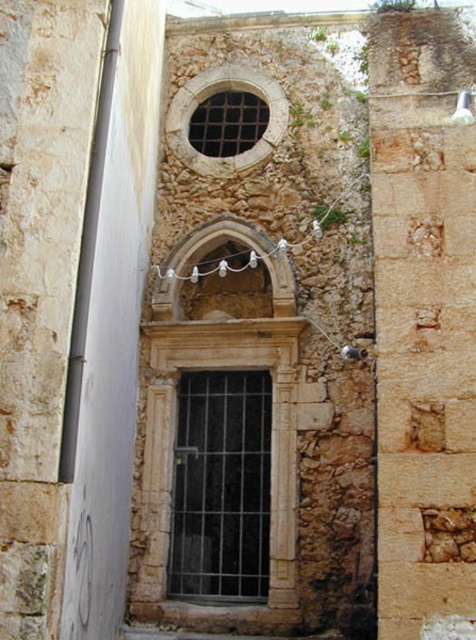
Is stone textured window at upper center below white stone archway at center?

No, stone textured window at upper center is not below white stone archway at center.

Between stone textured window at upper center and white stone archway at center, which one is positioned lower?

Positioned lower is white stone archway at center.

Locate an element on the screen. The width and height of the screenshot is (476, 640). stone textured window at upper center is located at coordinates (219, 92).

At what (x,y) coordinates should I click in order to perform the action: click on stone textured window at upper center. Please return your answer as a coordinate pair (x, y). The height and width of the screenshot is (640, 476). Looking at the image, I should click on (219, 92).

Can you confirm if black metal window at center is wider than stone textured window at upper center?

Incorrect, black metal window at center's width does not surpass stone textured window at upper center's.

Between point (216, 388) and point (189, 112), which one is positioned in front?

Positioned in front is point (216, 388).

Where is `black metal window at center`? Image resolution: width=476 pixels, height=640 pixels. black metal window at center is located at coordinates click(220, 484).

The height and width of the screenshot is (640, 476). Describe the element at coordinates (220, 484) in the screenshot. I see `black metal window at center` at that location.

Can you confirm if black metal window at center is smaller than matte stone window at upper center?

No.

You are a GUI agent. You are given a task and a screenshot of the screen. Output one action in this format:
    pyautogui.click(x=<x>, y=<y>)
    Task: Click on the black metal window at center
    
    Given the screenshot: What is the action you would take?
    pyautogui.click(x=220, y=484)

Where is `black metal window at center`? black metal window at center is located at coordinates (220, 484).